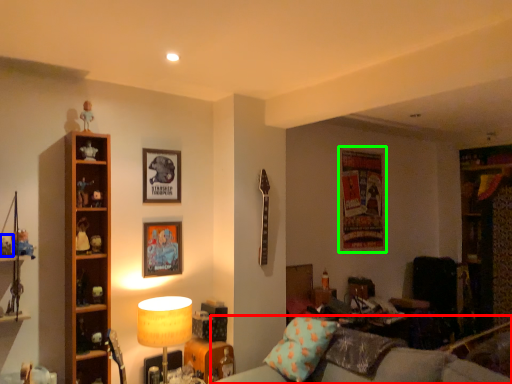
Question: Based on their relative distances, which object is nearer to studio couch (highlighted by a red box)? Choose from toy (highlighted by a blue box) and picture frame (highlighted by a green box).

Choices:
 (A) toy
 (B) picture frame

Answer: (B)